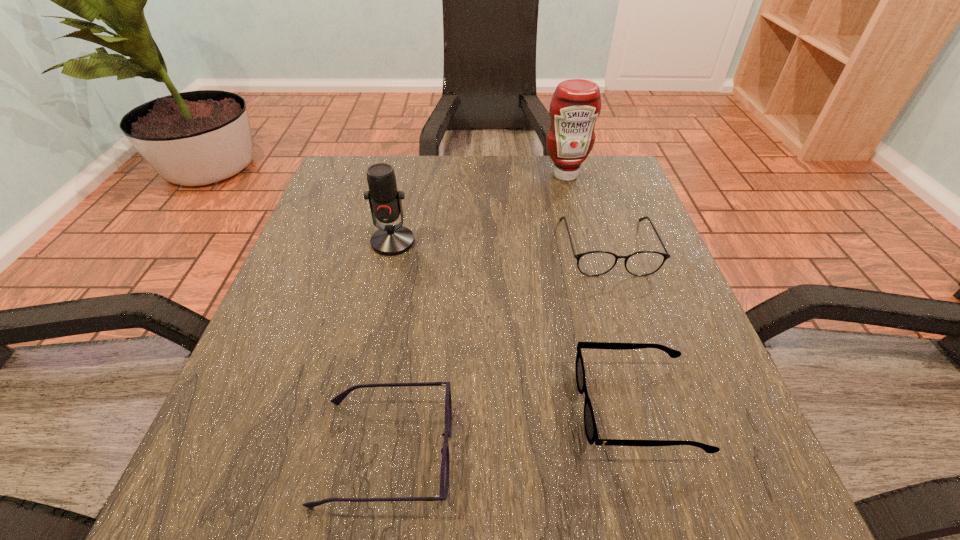
Where is `microphone that is at the left edge`? Image resolution: width=960 pixels, height=540 pixels. microphone that is at the left edge is located at coordinates (385, 203).

This screenshot has height=540, width=960. What are the coordinates of `spectacles positioned at the left edge` in the screenshot? It's located at (445, 461).

Locate an element on the screen. The height and width of the screenshot is (540, 960). condiment located at the right edge is located at coordinates (576, 104).

In order to click on object at the near left corner in this screenshot , I will do `click(445, 461)`.

You are a GUI agent. You are given a task and a screenshot of the screen. Output one action in this format:
    pyautogui.click(x=<x>, y=<y>)
    Task: Click on the object present at the far right corner
    
    Given the screenshot: What is the action you would take?
    pyautogui.click(x=576, y=104)

At what (x,y) coordinates should I click in order to perform the action: click on object at the near right corner. Please return your answer as a coordinate pair (x, y). The width and height of the screenshot is (960, 540). Looking at the image, I should click on (591, 432).

The image size is (960, 540). Find the location of `vacant space at the far edge`. vacant space at the far edge is located at coordinates (529, 173).

Locate an element on the screen. This screenshot has width=960, height=540. vacant space at the left edge of the desktop is located at coordinates click(x=313, y=301).

You are a GUI agent. You are given a task and a screenshot of the screen. Output one action in this format:
    pyautogui.click(x=<x>, y=<y>)
    Task: Click on the vacant area at the right edge
    
    Given the screenshot: What is the action you would take?
    click(694, 356)

The image size is (960, 540). I want to click on vacant space at the far right corner of the desktop, so click(x=621, y=171).